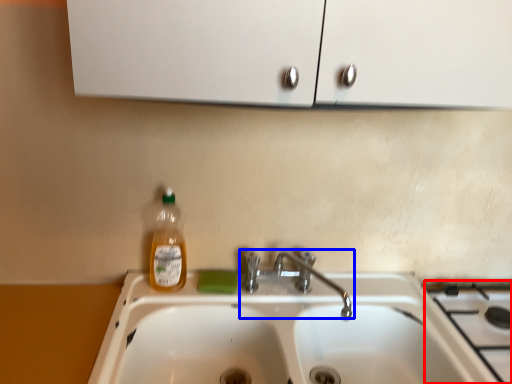
Question: Which object is further to the camera taking this photo, gas stove (highlighted by a red box) or tap (highlighted by a blue box)?

Choices:
 (A) gas stove
 (B) tap

Answer: (B)